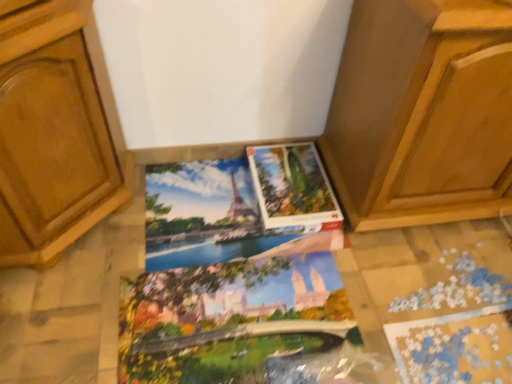
Identify the location of free point above matte paper coloring book at center, marked as the first coloring book in a bottom-to-top arrangement (from a real-world perspective). This screenshot has width=512, height=384. (243, 323).